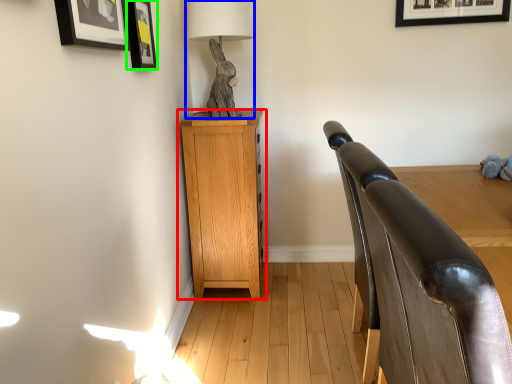
Question: Which is farther away from nightstand (highlighted by a red box)? table lamp (highlighted by a blue box) or picture frame (highlighted by a green box)?

Choices:
 (A) table lamp
 (B) picture frame

Answer: (B)